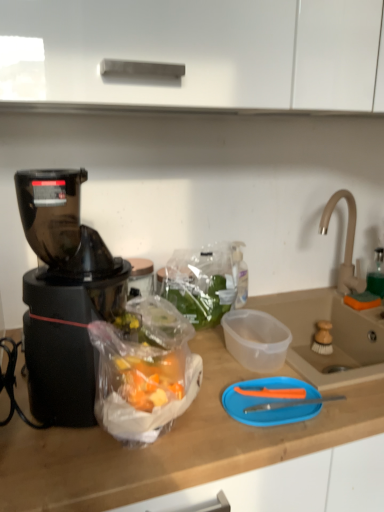
Where is `vacant space underneath beige ceramic sink at right, which is counted as the first sink, starting from the top (from a real-world perspective)`? This screenshot has width=384, height=512. vacant space underneath beige ceramic sink at right, which is counted as the first sink, starting from the top (from a real-world perspective) is located at coordinates (349, 301).